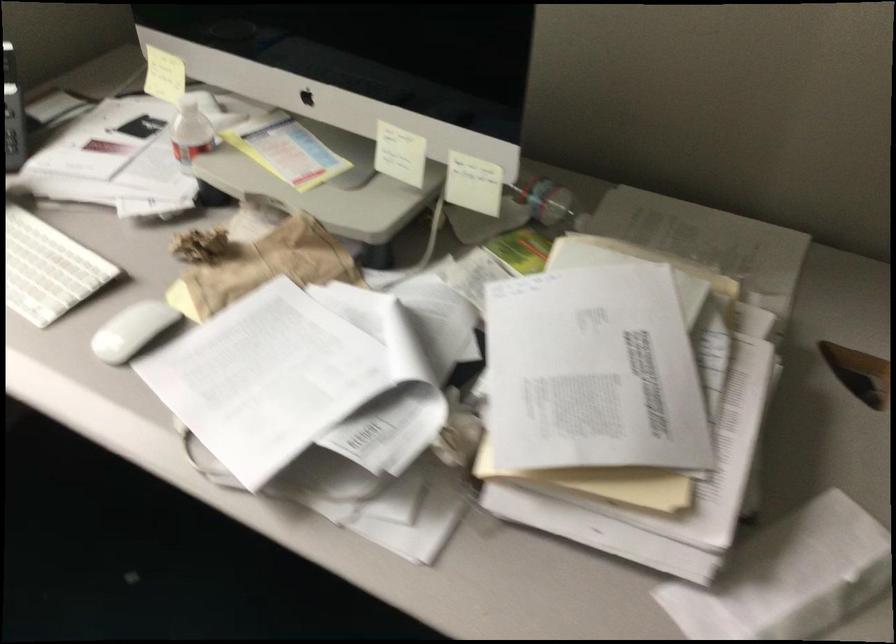
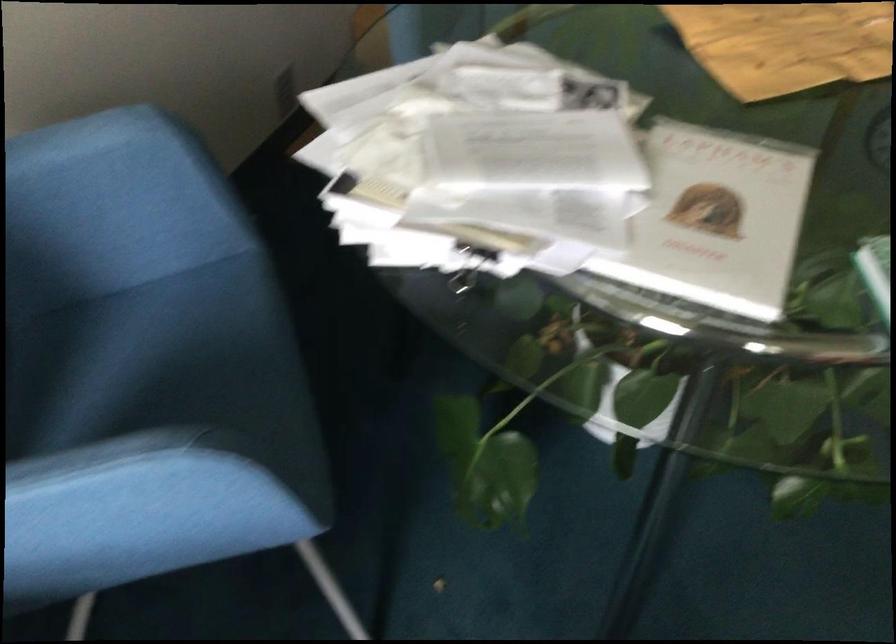
How did the camera likely rotate?

The rotation direction of the camera is right-down.